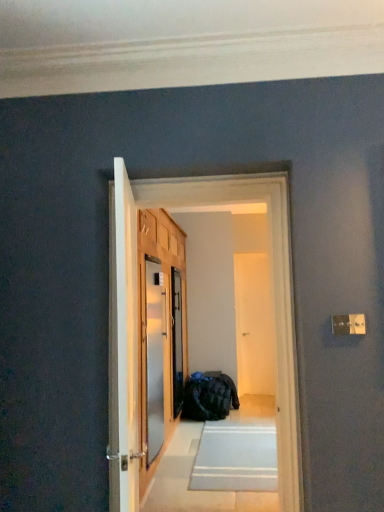
Question: Can you confirm if metallic refrigerator at center is smaller than satin silver screen door at center, the 3th screen door positioned from the right?

Choices:
 (A) no
 (B) yes

Answer: (A)

Question: From the image's perspective, is metallic refrigerator at center located beneath satin silver screen door at center, the third screen door positioned from the back?

Choices:
 (A) no
 (B) yes

Answer: (A)

Question: Is satin silver screen door at center, which is the 1th screen door from front to back, at the back of metallic refrigerator at center?

Choices:
 (A) yes
 (B) no

Answer: (A)

Question: Is the position of metallic refrigerator at center less distant than that of satin silver screen door at center, the 3th screen door positioned from the right?

Choices:
 (A) yes
 (B) no

Answer: (A)

Question: Is metallic refrigerator at center far away from satin silver screen door at center, the 3th screen door positioned from the right?

Choices:
 (A) yes
 (B) no

Answer: (A)

Question: Considering the positions of metallic refrigerator at center and white glossy door at center in the image, is metallic refrigerator at center wider or thinner than white glossy door at center?

Choices:
 (A) thin
 (B) wide

Answer: (B)

Question: From the image's perspective, relative to white glossy door at center, is metallic refrigerator at center above or below?

Choices:
 (A) above
 (B) below

Answer: (A)

Question: From a real-world perspective, is metallic refrigerator at center physically located above or below white glossy door at center?

Choices:
 (A) below
 (B) above

Answer: (B)

Question: Is metallic refrigerator at center bigger or smaller than white glossy door at center?

Choices:
 (A) big
 (B) small

Answer: (A)

Question: From a real-world perspective, is white glossy door at center, the first screen door in the back-to-front sequence, physically located above or below clear glass screen door at center, placed as the second screen door when sorted from right to left?

Choices:
 (A) below
 (B) above

Answer: (B)

Question: Is point (235, 258) positioned closer to the camera than point (177, 290)?

Choices:
 (A) farther
 (B) closer

Answer: (A)

Question: Which is correct: white glossy door at center, which ranks as the 3th screen door in left-to-right order, is inside clear glass screen door at center, the second screen door when ordered from front to back, or outside of it?

Choices:
 (A) outside
 (B) inside

Answer: (A)

Question: Considering the positions of white glossy door at center, the first screen door in the back-to-front sequence, and clear glass screen door at center, the second screen door from the left, in the image, is white glossy door at center, the first screen door in the back-to-front sequence, bigger or smaller than clear glass screen door at center, the second screen door from the left,?

Choices:
 (A) big
 (B) small

Answer: (B)

Question: Is white glossy door at center, which ranks as the 3th screen door in left-to-right order, taller or shorter than white glossy door at center?

Choices:
 (A) short
 (B) tall

Answer: (B)

Question: Based on their sizes in the image, would you say white glossy door at center, acting as the 1th screen door starting from the right, is bigger or smaller than white glossy door at center?

Choices:
 (A) small
 (B) big

Answer: (A)